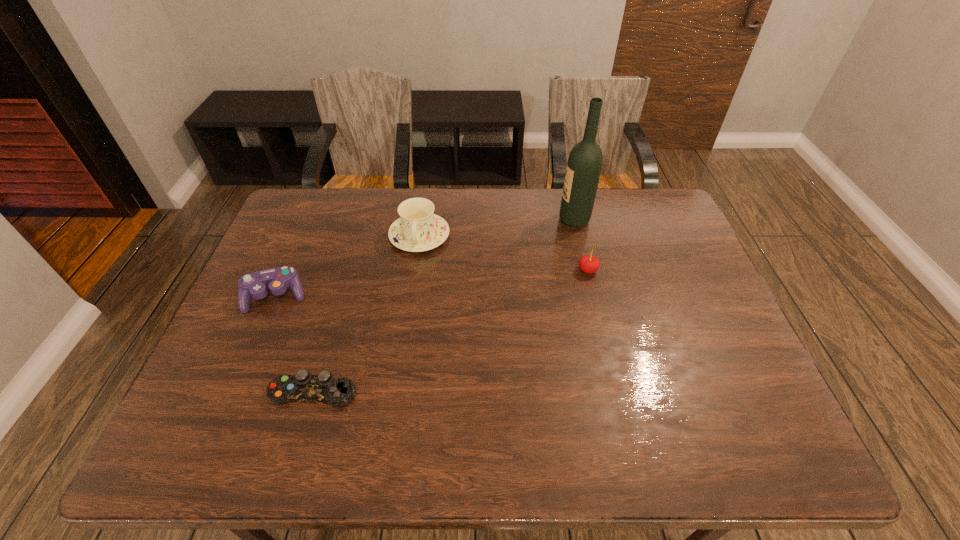
This screenshot has height=540, width=960. Find the location of `wine bottle`. wine bottle is located at coordinates (584, 165).

This screenshot has width=960, height=540. I want to click on chinaware, so click(418, 229).

Image resolution: width=960 pixels, height=540 pixels. I want to click on the third farthest object, so click(x=589, y=264).

Locate an element on the screen. The height and width of the screenshot is (540, 960). the farther control is located at coordinates (277, 280).

I want to click on the taller control, so click(277, 280).

At what (x,y) coordinates should I click in order to perform the action: click on the nearer control. Please return your answer as a coordinate pair (x, y). Looking at the image, I should click on (323, 388).

Locate an element on the screen. the nearest object is located at coordinates (323, 388).

This screenshot has width=960, height=540. Find the location of `blank area located on the labeled side of the tallest object`. blank area located on the labeled side of the tallest object is located at coordinates (450, 220).

Identify the location of vacant space located 0.320m on the labeled side of the tallest object. Image resolution: width=960 pixels, height=540 pixels. (462, 220).

Identify the location of vacant space positioned 0.400m on the labeled side of the tallest object. This screenshot has width=960, height=540. (438, 220).